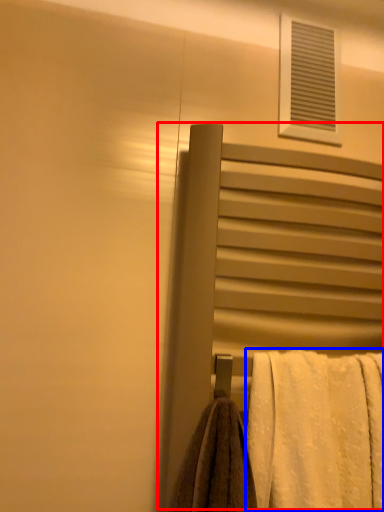
Question: Which object is further to the camera taking this photo, screen door (highlighted by a red box) or towel (highlighted by a blue box)?

Choices:
 (A) screen door
 (B) towel

Answer: (A)